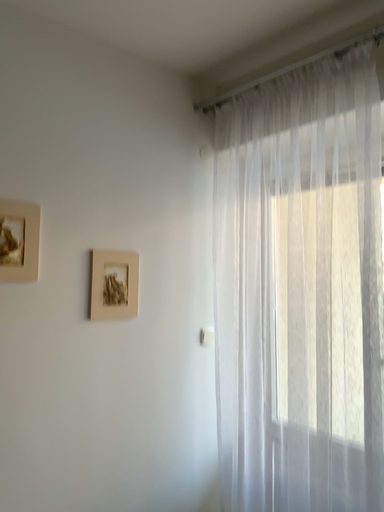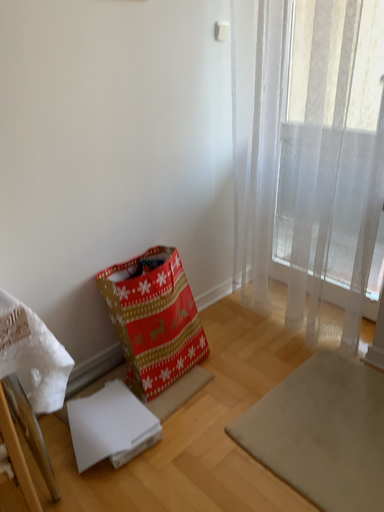
Question: Which way did the camera rotate in the video?

Choices:
 (A) rotated upward
 (B) rotated downward

Answer: (B)